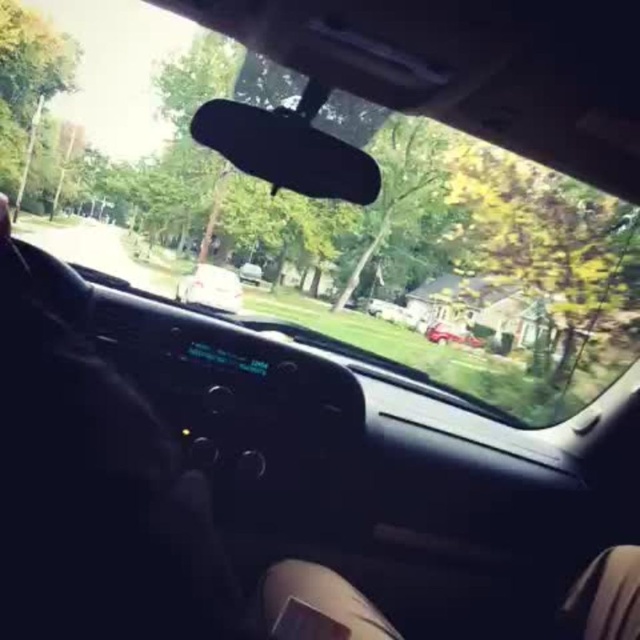
Between white glossy sedan at center and metallic silver car at center, which one is positioned lower?

metallic silver car at center is lower down.

Between white glossy sedan at center and metallic silver car at center, which one is positioned higher?

white glossy sedan at center is higher up.

Find the location of a particular element. This screenshot has width=640, height=640. white glossy sedan at center is located at coordinates [211, 288].

Can you confirm if transparent glass car window at center is wider than white glossy sedan at center?

Yes, transparent glass car window at center is wider than white glossy sedan at center.

Between transparent glass car window at center and white glossy sedan at center, which one appears on the right side from the viewer's perspective?

transparent glass car window at center is more to the right.

Which is behind, point (385, 68) or point (176, 292)?

The point (176, 292) is more distant.

I want to click on transparent glass car window at center, so click(376, 161).

In the scene shown: Is transparent glass car window at center shorter than metallic silver car at center?

In fact, transparent glass car window at center may be taller than metallic silver car at center.

Is transparent glass car window at center bigger than metallic silver car at center?

Correct, transparent glass car window at center is larger in size than metallic silver car at center.

Image resolution: width=640 pixels, height=640 pixels. What are the coordinates of `transparent glass car window at center` in the screenshot? It's located at (376, 161).

Locate an element on the screen. transparent glass car window at center is located at coordinates (376, 161).